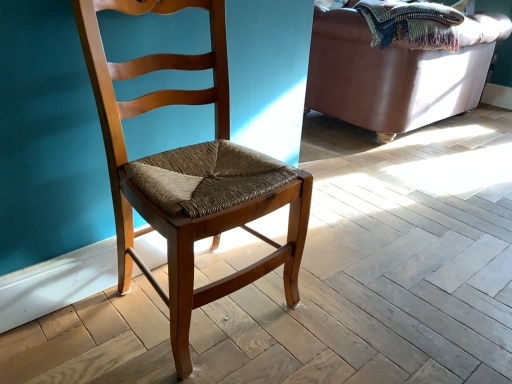
Question: Is woven multicolored blanket at upper right oriented away from wooden chair at center?

Choices:
 (A) no
 (B) yes

Answer: (A)

Question: From a real-world perspective, is woven multicolored blanket at upper right on top of wooden chair at center?

Choices:
 (A) yes
 (B) no

Answer: (A)

Question: Can you confirm if woven multicolored blanket at upper right is shorter than wooden chair at center?

Choices:
 (A) no
 (B) yes

Answer: (B)

Question: Considering the relative sizes of woven multicolored blanket at upper right and wooden chair at center in the image provided, is woven multicolored blanket at upper right bigger than wooden chair at center?

Choices:
 (A) yes
 (B) no

Answer: (B)

Question: Is woven multicolored blanket at upper right facing towards wooden chair at center?

Choices:
 (A) no
 (B) yes

Answer: (A)

Question: In terms of size, does leather couch at upper right appear bigger or smaller than woven multicolored blanket at upper right?

Choices:
 (A) big
 (B) small

Answer: (A)

Question: Does point (440, 117) appear closer or farther from the camera than point (419, 3)?

Choices:
 (A) farther
 (B) closer

Answer: (A)

Question: From the image's perspective, relative to woven multicolored blanket at upper right, is leather couch at upper right above or below?

Choices:
 (A) below
 (B) above

Answer: (A)

Question: From their relative heights in the image, would you say leather couch at upper right is taller or shorter than woven multicolored blanket at upper right?

Choices:
 (A) tall
 (B) short

Answer: (A)

Question: In the image, is wooden chair at center positioned in front of or behind leather couch at upper right?

Choices:
 (A) front
 (B) behind

Answer: (A)

Question: Based on their sizes in the image, would you say wooden chair at center is bigger or smaller than leather couch at upper right?

Choices:
 (A) small
 (B) big

Answer: (A)

Question: Considering the positions of wooden chair at center and leather couch at upper right in the image, is wooden chair at center wider or thinner than leather couch at upper right?

Choices:
 (A) wide
 (B) thin

Answer: (B)

Question: Visually, is wooden chair at center positioned to the left or to the right of leather couch at upper right?

Choices:
 (A) left
 (B) right

Answer: (A)

Question: Visually, is leather couch at upper right positioned to the left or to the right of wooden chair at center?

Choices:
 (A) left
 (B) right

Answer: (B)

Question: Is leather couch at upper right bigger or smaller than wooden chair at center?

Choices:
 (A) small
 (B) big

Answer: (B)